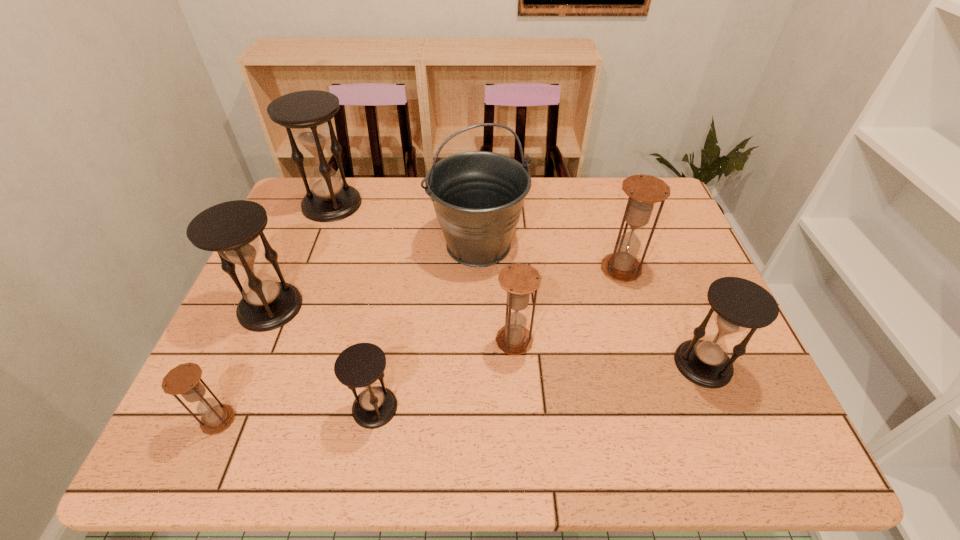
Where is `free space that is in between the fourth hourglass from left to right and the nearest brown hourglass`? free space that is in between the fourth hourglass from left to right and the nearest brown hourglass is located at coordinates [297, 414].

This screenshot has width=960, height=540. In order to click on free area in between the gray bucket and the third smallest black hourglass in this screenshot , I will do `click(374, 276)`.

At what (x,y) coordinates should I click in order to perform the action: click on empty space between the fourth hourglass from right to left and the leftmost brown hourglass. Please return your answer as a coordinate pair (x, y). Looking at the image, I should click on point(297,414).

Where is `free space that is in between the farthest brown hourglass and the gray bucket`? free space that is in between the farthest brown hourglass and the gray bucket is located at coordinates (550, 257).

This screenshot has height=540, width=960. I want to click on empty space that is in between the second smallest brown hourglass and the farthest black hourglass, so click(x=423, y=273).

Identify the location of blank region between the sixth nearest hourglass and the leftmost brown hourglass. (420, 345).

At what (x,y) coordinates should I click in order to perform the action: click on free space between the rightmost black hourglass and the nearest brown hourglass. Please return your answer as a coordinate pair (x, y). The width and height of the screenshot is (960, 540). Looking at the image, I should click on (461, 392).

The height and width of the screenshot is (540, 960). I want to click on blank region between the gray bucket and the second biggest black hourglass, so click(x=374, y=276).

At what (x,y) coordinates should I click in order to perform the action: click on blank region between the gray bucket and the fourth hourglass from right to left. Please return your answer as a coordinate pair (x, y). Looking at the image, I should click on (427, 326).

Identify which object is the fourth nearest to the sixth nearest hourglass. Please provide its 2D coordinates. Your answer should be formatted as a tuple, i.e. [(x, y)], where the tuple contains the x and y coordinates of a point satisfying the conditions above.

[(358, 366)]